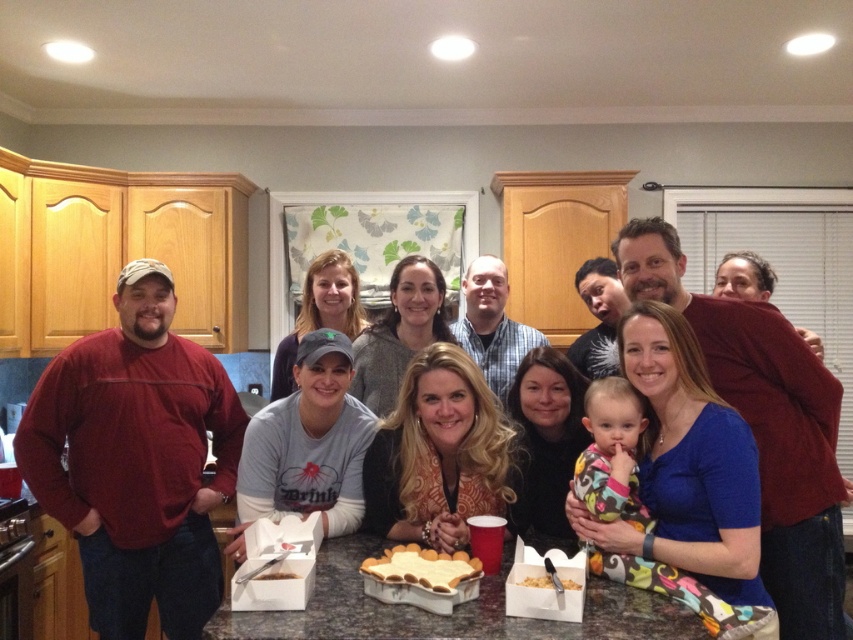
Does matte red shirt at left have a lesser width compared to crumbly brown cake at center?

No.

Between matte red shirt at left and crumbly brown cake at center, which one has less height?

crumbly brown cake at center

Who is more distant from viewer, (200, 541) or (552, 576)?

Point (200, 541)

The height and width of the screenshot is (640, 853). Find the location of `matte red shirt at left`. matte red shirt at left is located at coordinates (136, 460).

Does red cotton shirt at left have a smaller size compared to white frosted cake at center?

No, red cotton shirt at left is not smaller than white frosted cake at center.

Is red cotton shirt at left thinner than white frosted cake at center?

Incorrect, red cotton shirt at left's width is not less than white frosted cake at center's.

Between point (773, 488) and point (415, 545), which one is positioned behind?

Point (773, 488)

This screenshot has height=640, width=853. I want to click on red cotton shirt at left, so click(751, 397).

Is point (155, 449) positioned before point (270, 572)?

No, it is behind (270, 572).

Is point (144, 348) closer to viewer compared to point (257, 577)?

No.

Find the location of a particular element. matte red shirt at left is located at coordinates (136, 460).